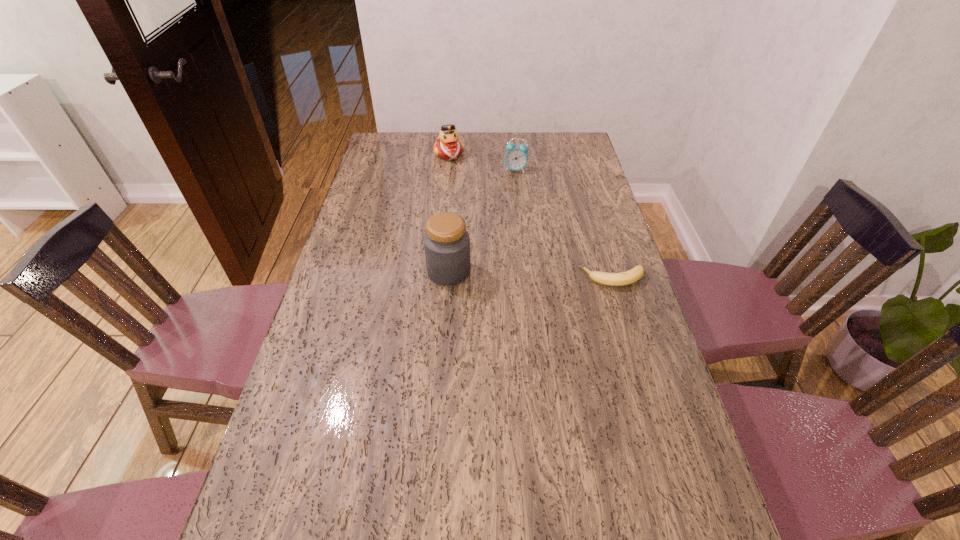
Image resolution: width=960 pixels, height=540 pixels. What are the coordinates of `vacant position located 0.200m at the stem of the rightmost object` in the screenshot? It's located at (515, 278).

You are a GUI agent. You are given a task and a screenshot of the screen. Output one action in this format:
    pyautogui.click(x=<x>, y=<y>)
    Task: Click on the free space located at the stem of the rightmost object
    This screenshot has height=540, width=960.
    Given the screenshot: What is the action you would take?
    pyautogui.click(x=501, y=278)

Identify the location of vacant space located on the face of the second object from right to left. (519, 222).

Locate an element on the screen. This screenshot has width=960, height=540. free spot located on the face of the second object from right to left is located at coordinates (521, 239).

Locate an element on the screen. This screenshot has height=540, width=960. free space located 0.160m on the face of the second object from right to left is located at coordinates (517, 198).

Identify the location of blank space located 0.080m on the face of the duck. (459, 173).

Find the location of a particular element. Image resolution: width=960 pixels, height=540 pixels. vacant area located on the face of the duck is located at coordinates (466, 185).

Image resolution: width=960 pixels, height=540 pixels. Identify the location of free point located on the face of the duck. (478, 206).

Locate an element on the screen. This screenshot has height=540, width=960. object that is at the far edge is located at coordinates (448, 147).

This screenshot has height=540, width=960. Identify the location of object that is at the right edge. (625, 278).